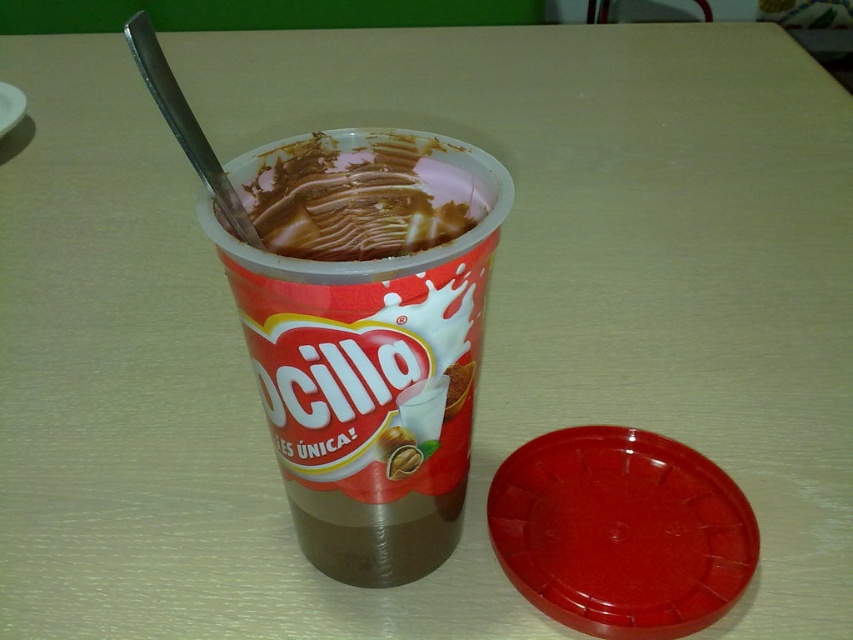
Question: Is brown matte plastic cup at center further to the viewer compared to chocolate creamy ice cream at center?

Choices:
 (A) yes
 (B) no

Answer: (B)

Question: Can you confirm if brown matte plastic cup at center is bigger than chocolate creamy ice cream at center?

Choices:
 (A) yes
 (B) no

Answer: (A)

Question: Which point is farther from the camera taking this photo?

Choices:
 (A) (309, 216)
 (B) (289, 470)

Answer: (B)

Question: Which of the following is the closest to the observer?

Choices:
 (A) (361, 509)
 (B) (306, 234)

Answer: (A)

Question: Which point is closer to the camera?

Choices:
 (A) (289, 172)
 (B) (263, 161)

Answer: (B)

Question: Is brown matte plastic cup at center to the right of chocolate creamy ice cream at center from the viewer's perspective?

Choices:
 (A) yes
 (B) no

Answer: (A)